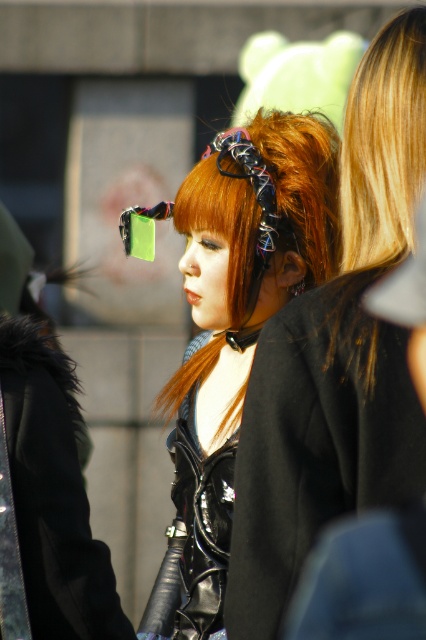
Between shiny black hair at center and multicolored fabric headscarf at center, which one has more height?

shiny black hair at center is taller.

I want to click on shiny black hair at center, so click(336, 356).

Which is in front, point (400, 49) or point (264, 236)?

Point (400, 49) is more forward.

The image size is (426, 640). I want to click on shiny black hair at center, so click(x=336, y=356).

Which is in front, point (351, 115) or point (226, 432)?

Point (351, 115) is in front.

Which is behind, point (233, 612) or point (218, 291)?

Point (218, 291)

Does point (267, 336) lie in front of point (299, 115)?

That is True.

Locate an element on the screen. The width and height of the screenshot is (426, 640). shiny black hair at center is located at coordinates (336, 356).

Is shiny black hair at center below blonde smooth hair at right?

Indeed, shiny black hair at center is positioned under blonde smooth hair at right.

Which of these two, shiny black hair at center or blonde smooth hair at right, stands taller?

shiny black hair at center is taller.

Where is `shiny black hair at center`? This screenshot has width=426, height=640. shiny black hair at center is located at coordinates (336, 356).